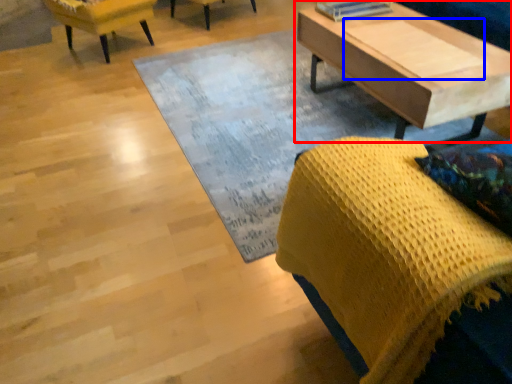
Question: Which object appears farthest to the camera in this image, coffee table (highlighted by a red box) or plank (highlighted by a blue box)?

Choices:
 (A) coffee table
 (B) plank

Answer: (B)